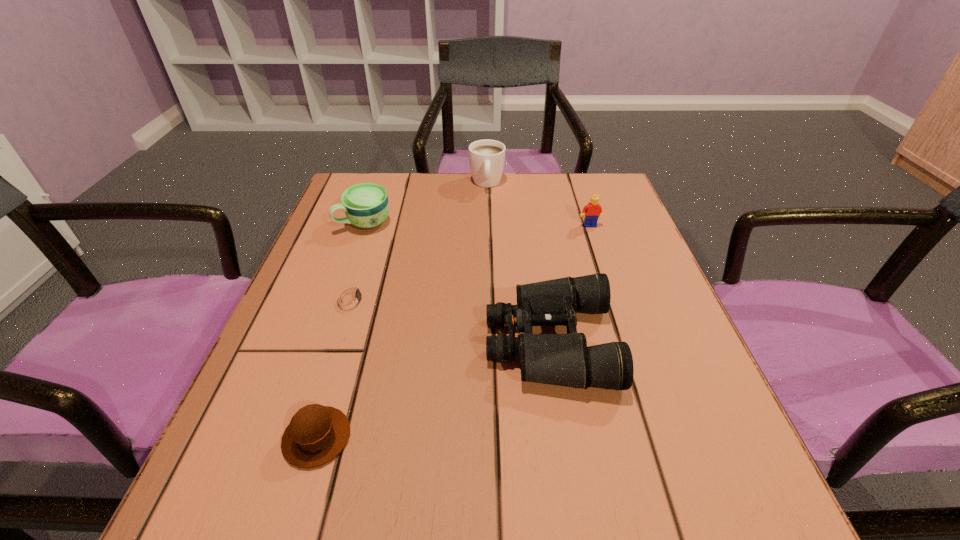
This screenshot has height=540, width=960. In order to click on free spot between the cup and the Lego in this screenshot , I will do `click(477, 224)`.

Where is `free space between the cup and the nearest object`? The width and height of the screenshot is (960, 540). free space between the cup and the nearest object is located at coordinates pyautogui.click(x=341, y=330).

Where is `vacant space that is in between the binoculars and the nearest object`? Image resolution: width=960 pixels, height=540 pixels. vacant space that is in between the binoculars and the nearest object is located at coordinates pos(433,390).

Identify the location of vacant area that lies between the muffin and the binoculars. pos(433,390).

Where is `unoccupied area between the binoculars and the cappuccino`? unoccupied area between the binoculars and the cappuccino is located at coordinates (518, 263).

The height and width of the screenshot is (540, 960). What are the coordinates of `free space between the binoculars and the watch` in the screenshot? It's located at (450, 320).

Where is `unoccupied area between the binoculars and the nearest object`? Image resolution: width=960 pixels, height=540 pixels. unoccupied area between the binoculars and the nearest object is located at coordinates (433, 390).

Locate an element on the screen. This screenshot has height=540, width=960. blank region between the nearest object and the Lego is located at coordinates (453, 332).

Identify which object is located as the fifth nearest to the binoculars. Please provide its 2D coordinates. Your answer should be formatted as a tuple, i.e. [(x, y)], where the tuple contains the x and y coordinates of a point satisfying the conditions above.

[(486, 157)]

Image resolution: width=960 pixels, height=540 pixels. I want to click on the third closest object relative to the binoculars, so point(593,210).